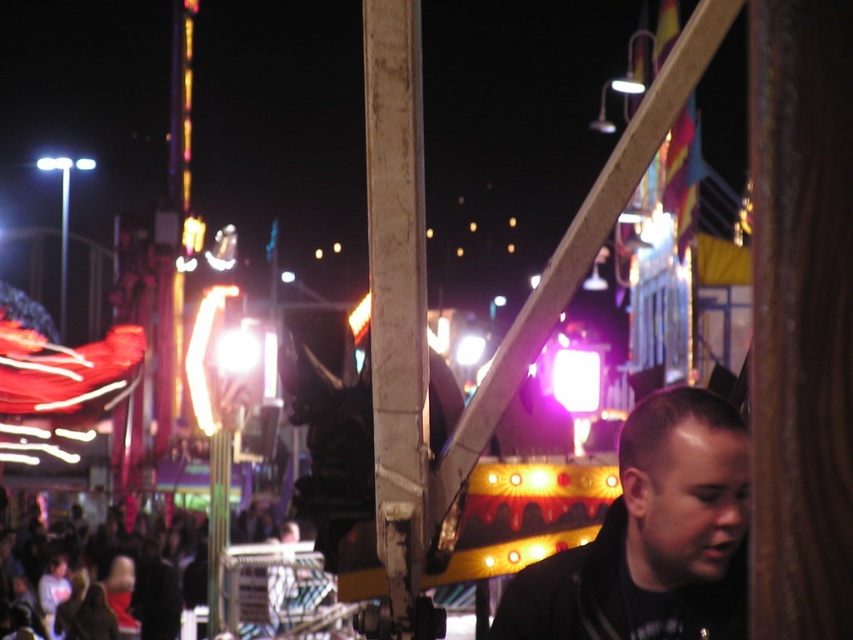
You are at the fairground and want to find a spot where you can easily move between the black matte jacket at lower right and the dark clothing crowd at lower left. Considering their sizes, which area would require more space to navigate around?

The dark clothing crowd at lower left requires more space to navigate around since its width is greater than the black matte jacket at lower right.

You are at the fairground and want to take a photo of the black matte jacket at lower right and the white painted wood pole at center. Since you want to include both in the frame, which object should you position closer to the camera to ensure both fit horizontally?

The black matte jacket at lower right has a smaller width than the white painted wood pole at center. To include both in the frame, position the black matte jacket at lower right closer to the camera since it is narrower, allowing more space for the wider pole in the background.

You are at the fairground and want to take a photo of the dark clothing crowd at lower left without the white painted wood pole at center blocking the view. Where should you position yourself to ensure the pole isn

To avoid the white painted wood pole at center blocking the view of the dark clothing crowd at lower left, position yourself to the side or lower than the current angle since the pole is above the crowd.